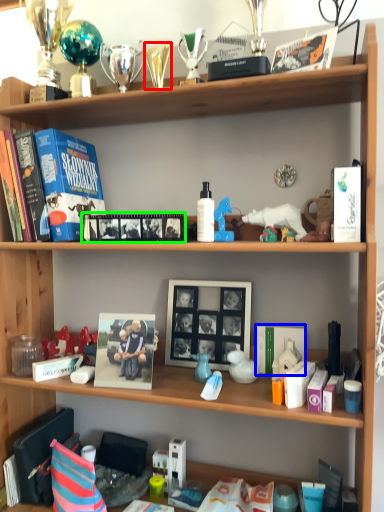
Question: Based on their relative distances, which object is nearer to toy (highlighted by a red box)? Choose from magazine (highlighted by a blue box) and magazine (highlighted by a green box).

Choices:
 (A) magazine
 (B) magazine

Answer: (B)